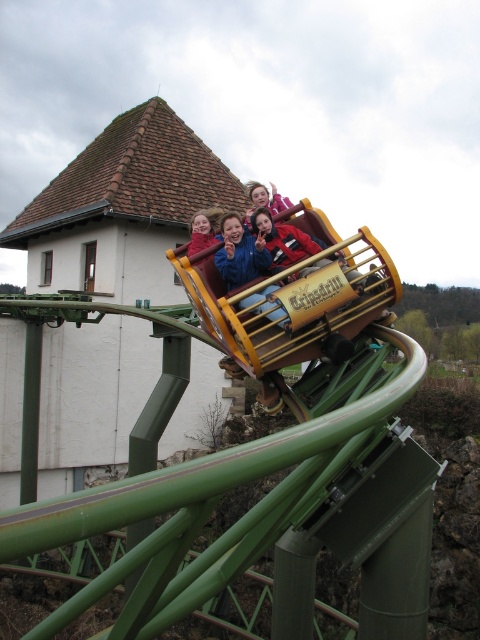
Question: Is matte blue jacket at center in front of blue denim jacket at upper center?

Choices:
 (A) no
 (B) yes

Answer: (B)

Question: Estimate the real-world distances between objects in this image. Which object is closer to the wooden roller coaster at center?

Choices:
 (A) matte blue jacket at center
 (B) blue denim jacket at upper center

Answer: (A)

Question: Is the position of wooden roller coaster at center less distant than that of blue denim jacket at upper center?

Choices:
 (A) yes
 (B) no

Answer: (A)

Question: Which is nearer to the blue denim jacket at center?

Choices:
 (A) blue denim jacket at upper center
 (B) wooden roller coaster at center

Answer: (B)

Question: Can you confirm if wooden roller coaster at center is thinner than blue denim jacket at upper center?

Choices:
 (A) yes
 (B) no

Answer: (B)

Question: Based on their relative distances, which object is nearer to the wooden roller coaster at center?

Choices:
 (A) blue denim jacket at upper center
 (B) blue denim jacket at center
 (C) matte blue jacket at center

Answer: (B)